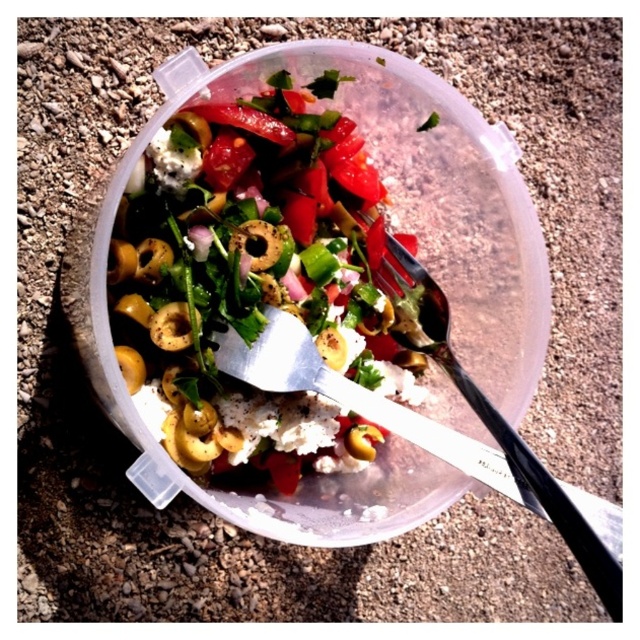
You are a food delivery robot with a 10 inch wide arm. You need to pick up the metallic silver fork at center from the shiny plastic salad bowl at center. Can your arm fit between the bowl and the fork to grab the fork?

The distance between the shiny plastic salad bowl at center and the metallic silver fork at center is 8.35 inches. Since your arm is 10 inches wide, it can fit as the required space is less than your arm width.